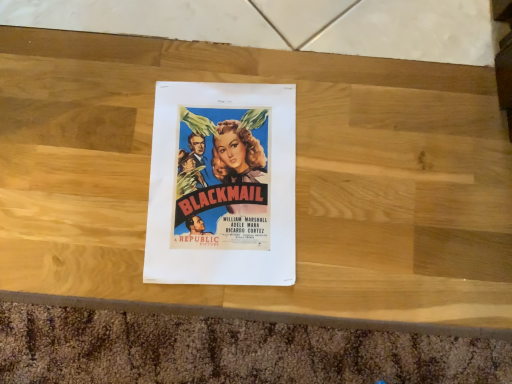
The width and height of the screenshot is (512, 384). I want to click on matte paper poster at center, so click(222, 185).

Describe the element at coordinates (222, 185) in the screenshot. I see `matte paper poster at center` at that location.

Identify the location of matte paper poster at center. (222, 185).